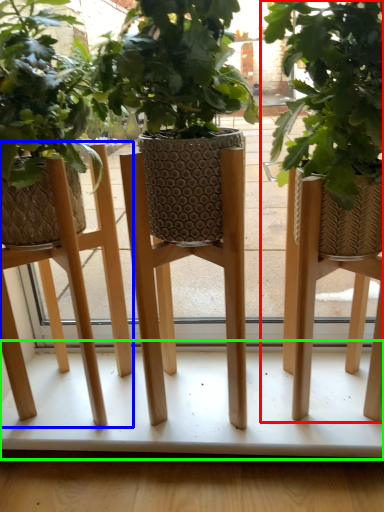
Question: Based on their relative distances, which object is nearer to houseplant (highlighted by a red box)? Choose from stool (highlighted by a blue box) and table (highlighted by a green box).

Choices:
 (A) stool
 (B) table

Answer: (B)